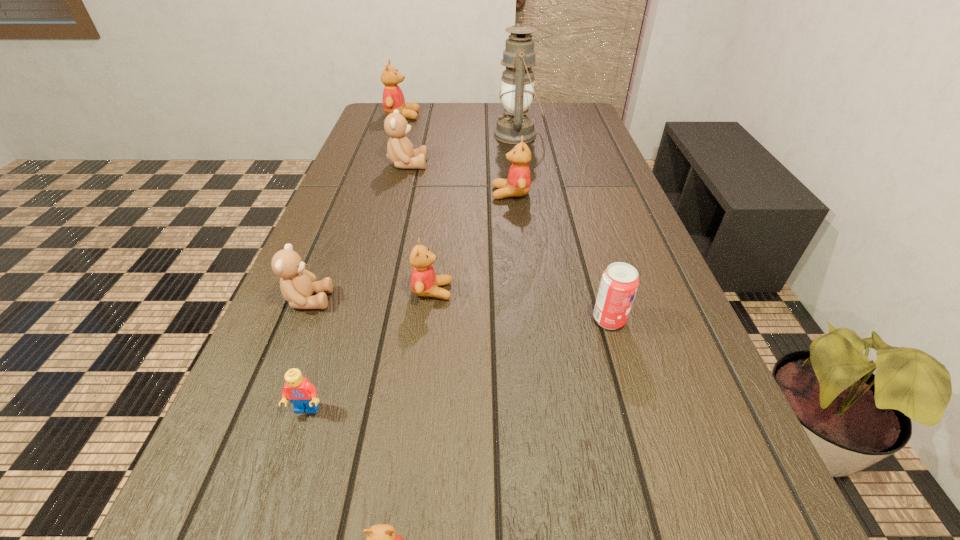
Where is `brown oil lamp`? The image size is (960, 540). brown oil lamp is located at coordinates (517, 90).

Where is `oil lamp`? This screenshot has width=960, height=540. oil lamp is located at coordinates (517, 90).

Identify the location of the second tallest object. This screenshot has width=960, height=540. (393, 99).

The image size is (960, 540). Identify the location of the farthest teddy bear. (393, 99).

You are a GUI agent. You are given a task and a screenshot of the screen. Output one action in this format:
    pyautogui.click(x=<x>, y=<y>)
    Task: Click on the third farthest object
    This screenshot has width=960, height=540.
    Given the screenshot: What is the action you would take?
    pyautogui.click(x=400, y=151)

Where is `the right brown teddy bear`? the right brown teddy bear is located at coordinates (400, 151).

This screenshot has height=540, width=960. I want to click on the rightmost teddy bear, so click(518, 182).

The height and width of the screenshot is (540, 960). I want to click on the third smallest red teddy bear, so click(x=518, y=182).

The image size is (960, 540). I want to click on the second nearest red teddy bear, so click(x=424, y=282).

You are a GUI agent. You are given a task and a screenshot of the screen. Output one action in this format:
    pyautogui.click(x=<x>, y=<y>)
    Task: Click on the left brown teddy bear
    
    Given the screenshot: What is the action you would take?
    pyautogui.click(x=297, y=285)